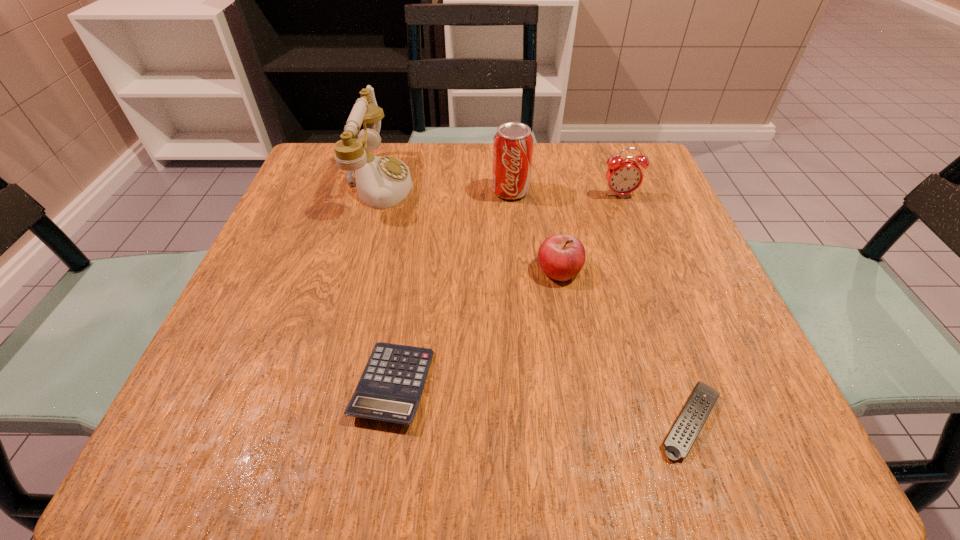
The height and width of the screenshot is (540, 960). I want to click on free space at the far right corner of the desktop, so click(x=619, y=143).

Locate an element on the screen. The height and width of the screenshot is (540, 960). vacant point at the near right corner is located at coordinates (726, 448).

At what (x,y) coordinates should I click in order to perform the action: click on vacant space in between the fifth shortest object and the telephone. Please return your answer as a coordinate pair (x, y). Looking at the image, I should click on pyautogui.click(x=444, y=187).

This screenshot has width=960, height=540. I want to click on blank region between the apple and the calculator, so click(x=476, y=327).

Find the location of a particular element. Image resolution: width=960 pixels, height=540 pixels. free spot between the fifth shortest object and the remote control is located at coordinates tap(601, 306).

Where is `empty space between the remote control and the third shortest object`? empty space between the remote control and the third shortest object is located at coordinates (625, 346).

Image resolution: width=960 pixels, height=540 pixels. I want to click on empty location between the remote control and the third shortest object, so click(x=625, y=346).

At what (x,y) coordinates should I click in order to perform the action: click on vacant area between the tallest object and the second shortest object. Please return your answer as a coordinate pair (x, y). The height and width of the screenshot is (540, 960). Looking at the image, I should click on pyautogui.click(x=386, y=284).

Find the location of a particular element. The image size is (960, 540). free point between the fifth tallest object and the fourth farthest object is located at coordinates (476, 327).

Where is `vacant region between the third shortest object and the shortest object`? vacant region between the third shortest object and the shortest object is located at coordinates (625, 346).